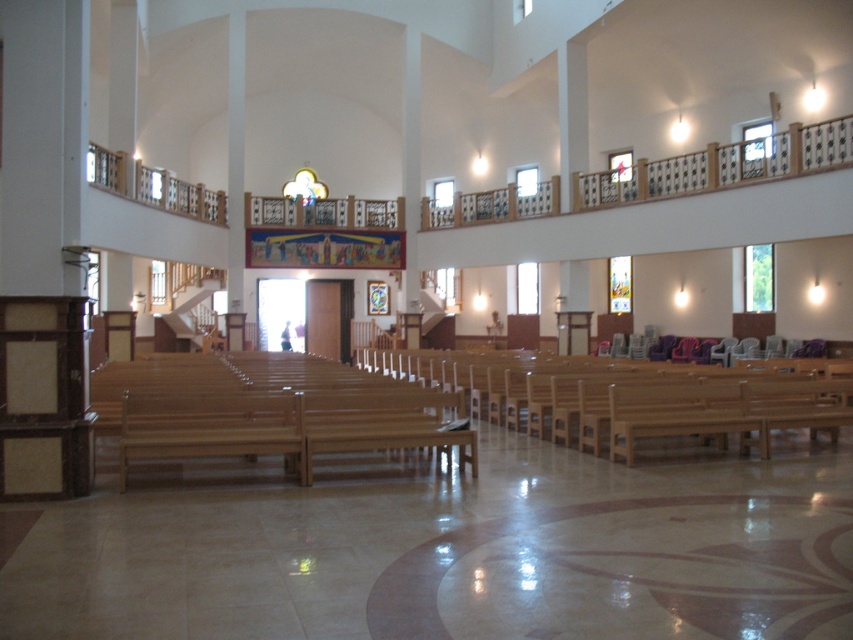
You are standing at the entrance of the church and want to walk directly to the wooden at center. Which direction should you head towards?

The wooden at center is located at point coordinates, so you should head towards the center of the room to reach it.

You are standing in the church and want to sit down. You see the wooden at center and the wooden church bench at center. Which one is closer to your current position if you are facing the altar?

The wooden at center is closer to your current position because it is to the left of the wooden church bench at center, and when facing the altar, the left side would be nearer if you are in the central aisle.

You are standing at the entrance of the church and see two points marked on the floor. The first point is at coordinates point (410, 436) and the second point is at coordinates point (593, 369). Which point is closer to you?

Point (410, 436) is closer to the viewer than point (593, 369).